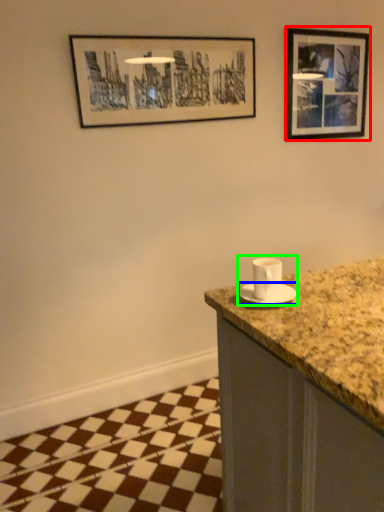
Question: Which is farther away from picture frame (highlighted by a red box)? saucer (highlighted by a blue box) or sink (highlighted by a green box)?

Choices:
 (A) saucer
 (B) sink

Answer: (A)